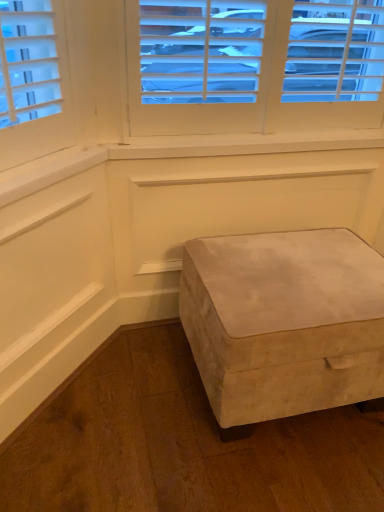
Locate an element on the screen. free spot above beige suede ottoman at lower right (from a real-world perspective) is located at coordinates (291, 274).